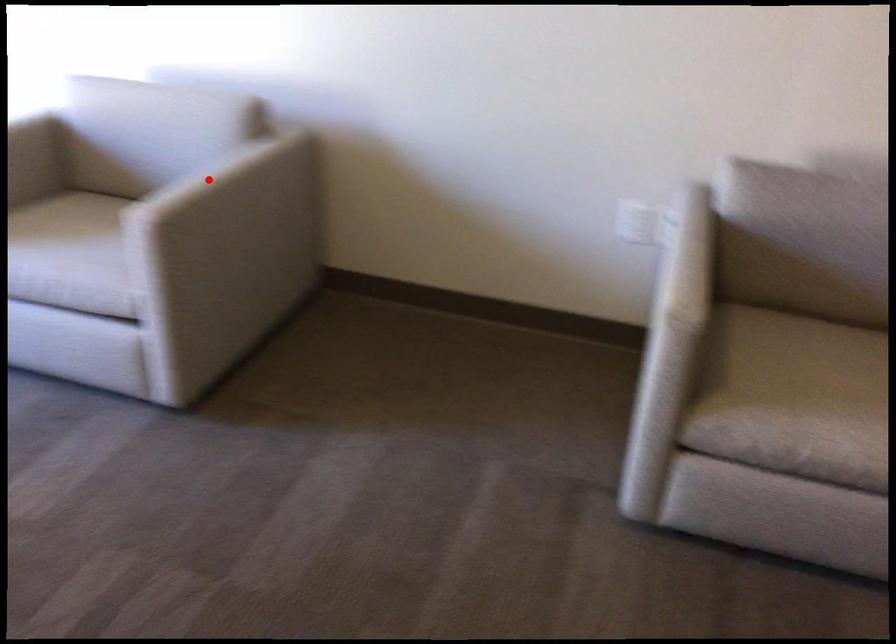
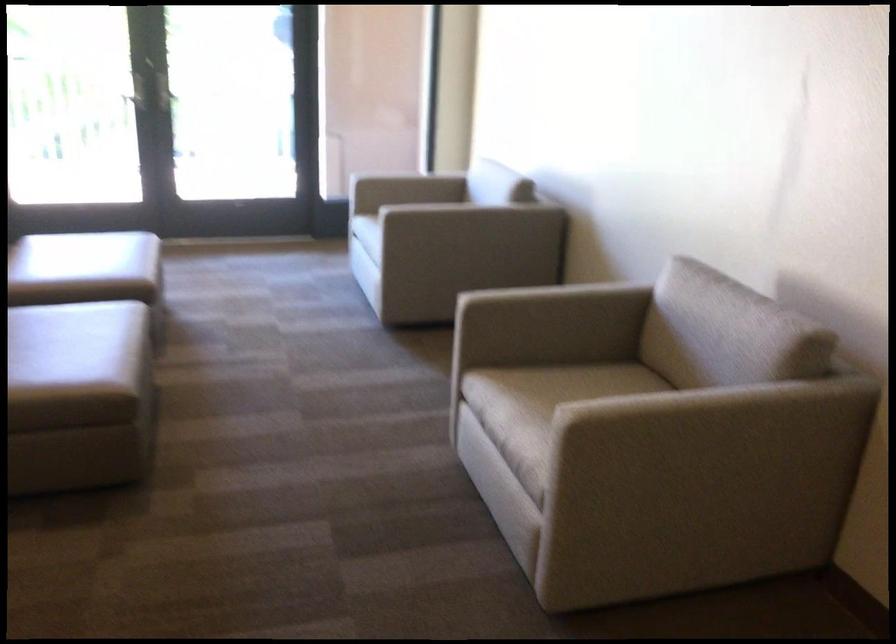
Locate, in the second image, the point that corresponds to the highlighted location in the first image.

(428, 202)